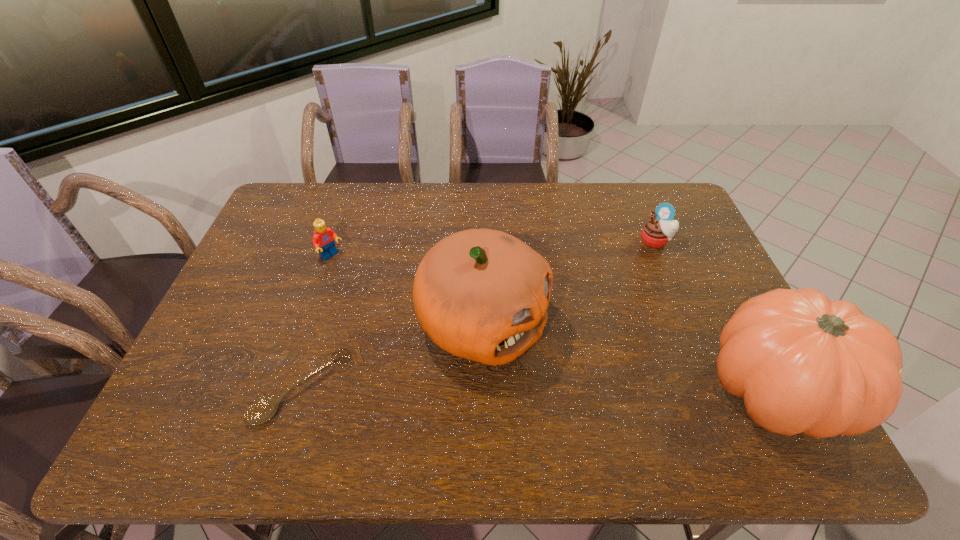
Locate an element on the screen. This screenshot has width=960, height=540. vacant position at the near edge of the desktop is located at coordinates (501, 389).

At what (x,y) coordinates should I click in order to perform the action: click on free space at the left edge of the desktop. Please return your answer as a coordinate pair (x, y). This screenshot has width=960, height=540. Looking at the image, I should click on (301, 241).

You are a GUI agent. You are given a task and a screenshot of the screen. Output one action in this format:
    pyautogui.click(x=<x>, y=<y>)
    Task: Click on the free point at the right edge
    
    Given the screenshot: What is the action you would take?
    pyautogui.click(x=726, y=299)

The height and width of the screenshot is (540, 960). In order to click on free space at the far right corner of the desktop in this screenshot , I will do `click(659, 185)`.

The image size is (960, 540). I want to click on free space that is in between the Lego and the ladle, so click(317, 322).

At what (x,y) coordinates should I click in order to perform the action: click on vacant space that's between the muffin and the third object from left to right. Please return your answer as a coordinate pair (x, y). Looking at the image, I should click on (569, 282).

Locate an element on the screen. vacant area that lies between the right pumpkin and the left pumpkin is located at coordinates coord(628,357).

The image size is (960, 540). I want to click on vacant space that's between the left pumpkin and the right pumpkin, so click(628, 357).

Where is `blank region between the right pumpkin and the Lego`? blank region between the right pumpkin and the Lego is located at coordinates (553, 323).

You are a GUI agent. You are given a task and a screenshot of the screen. Output one action in this format:
    pyautogui.click(x=<x>, y=<y>)
    Task: Click on the vacant area that lies between the ladle and the right pumpkin
    This screenshot has width=960, height=540.
    Given the screenshot: What is the action you would take?
    pyautogui.click(x=539, y=389)